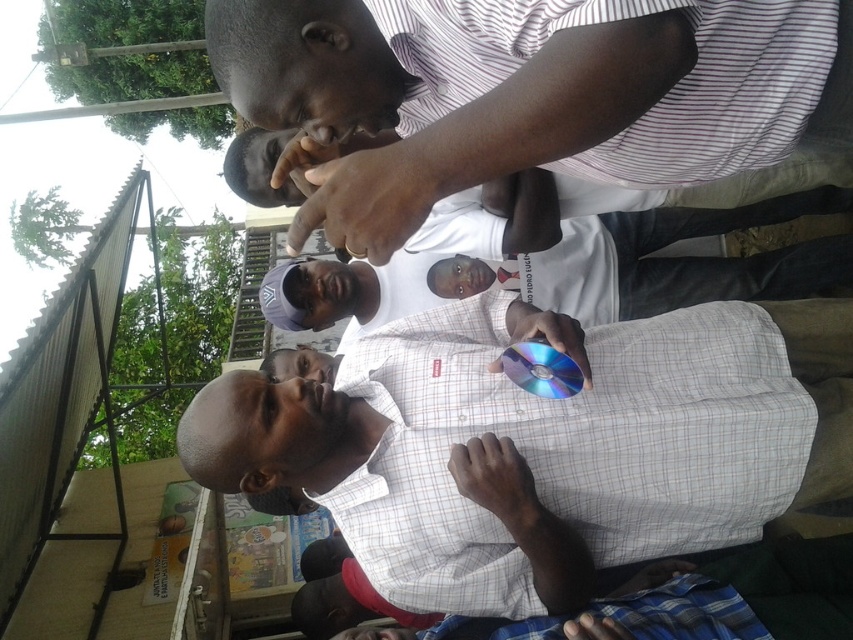
Question: Is the position of white checkered shirt at center more distant than that of striped shirt at upper center?

Choices:
 (A) yes
 (B) no

Answer: (A)

Question: Which point appears farthest from the camera in this image?

Choices:
 (A) (625, 72)
 (B) (498, 611)

Answer: (B)

Question: Where is white checkered shirt at center located in relation to striped shirt at upper center in the image?

Choices:
 (A) above
 (B) below

Answer: (B)

Question: Considering the relative positions of white checkered shirt at center and striped shirt at upper center in the image provided, where is white checkered shirt at center located with respect to striped shirt at upper center?

Choices:
 (A) below
 (B) above

Answer: (A)

Question: Among these objects, which one is nearest to the camera?

Choices:
 (A) striped shirt at upper center
 (B) white checkered shirt at center

Answer: (A)

Question: Which object appears farthest from the camera in this image?

Choices:
 (A) striped shirt at upper center
 (B) white checkered shirt at center

Answer: (B)